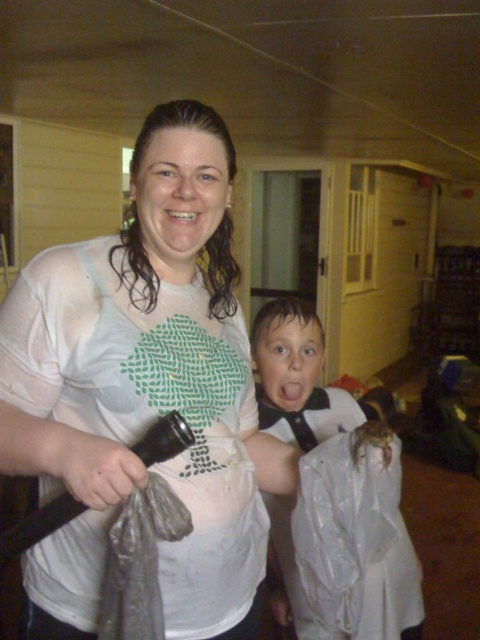
Which is behind, point (87, 563) or point (262, 353)?

The point (262, 353) is behind.

This screenshot has width=480, height=640. What do you see at coordinates (144, 388) in the screenshot?
I see `white matte t-shirt at center` at bounding box center [144, 388].

This screenshot has width=480, height=640. In order to click on white matte t-shirt at center in this screenshot , I will do pos(144,388).